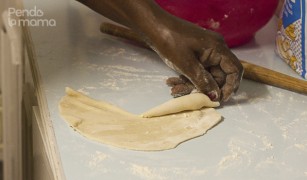
What are the coordinates of `countertop` in the screenshot? It's located at (67, 38).